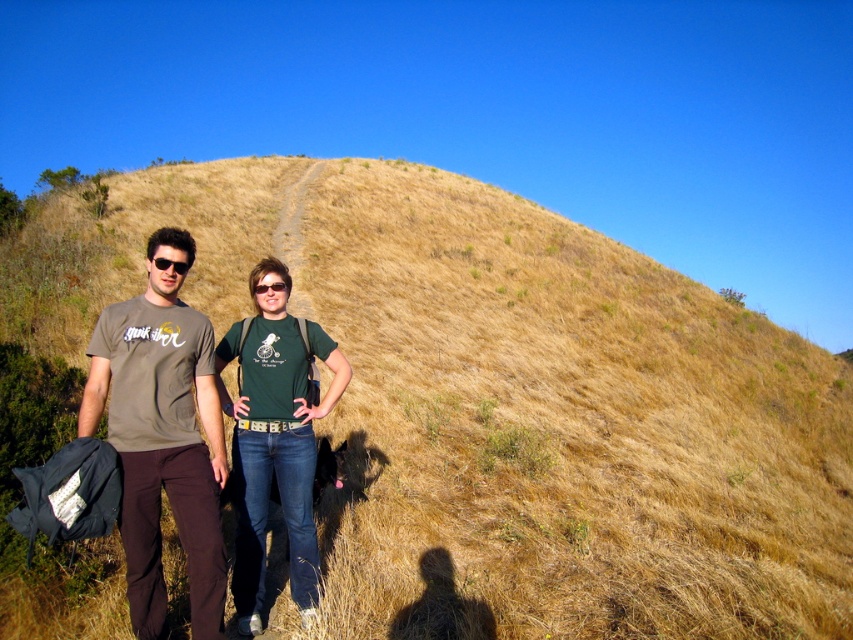
You are a photographer positioned at the bottom of the hill. You want to take a photo of both the green cotton shirt at center and the black plastic sunglasses at left. Which object should you adjust your focus on first to ensure both are in the frame?

The black plastic sunglasses at left is behind the green cotton shirt at center, so you should focus on the green cotton shirt at center first to ensure both are in the frame.

You are standing on the grassy hill and want to take a photo of the green cotton shirt at center and the black matte sunglasses at center. Which object should you focus on first if you want to capture both in the frame without moving the camera?

You should focus on the green cotton shirt at center first because it is to the right of the black matte sunglasses at center, so adjusting the camera to include both would require ensuring the rightmost object is within the frame first.

You are standing at the bottom of the hill and want to take a photo of the green cotton shirt at center. Based on the coordinates provided, in which direction should you move to frame the shirt properly?

The green cotton shirt at center is located at coordinates point (274, 440). Since the coordinates are relative to the image, moving towards the upper right direction would help frame the shirt properly.